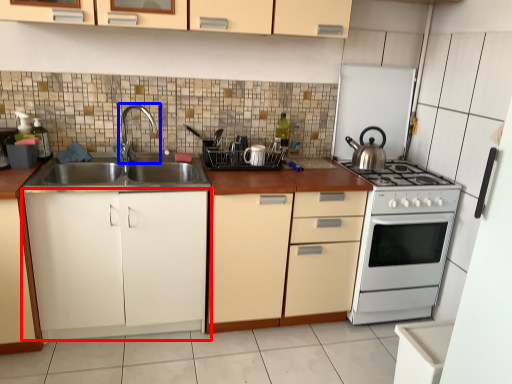
Question: Which object is further to the camera taking this photo, cabinetry (highlighted by a red box) or tap (highlighted by a blue box)?

Choices:
 (A) cabinetry
 (B) tap

Answer: (B)